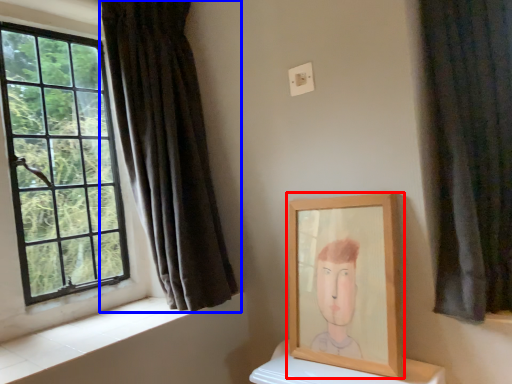
Question: Which point is further to the camera, picture frame (highlighted by a red box) or curtain (highlighted by a blue box)?

Choices:
 (A) picture frame
 (B) curtain

Answer: (B)